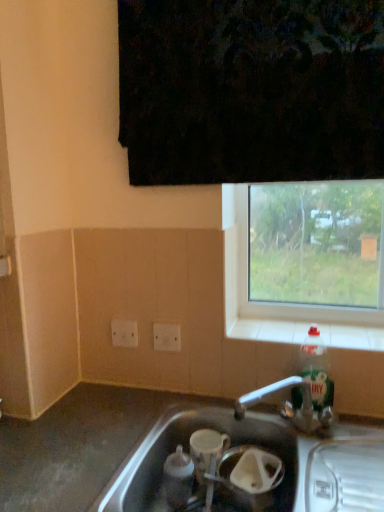
Locate an element on the screen. Image resolution: width=384 pixels, height=512 pixels. vacant point above silver metallic sink at lower center (from a real-world perspective) is located at coordinates (105, 433).